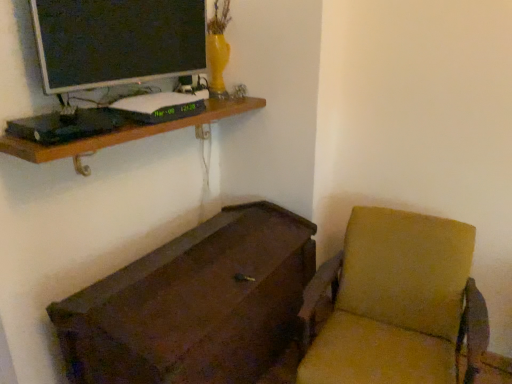
Question: From a real-world perspective, is brown wooden chest at lower left above or below brown wooden shelf at upper left?

Choices:
 (A) below
 (B) above

Answer: (A)

Question: Is brown wooden chest at lower left taller or shorter than brown wooden shelf at upper left?

Choices:
 (A) tall
 (B) short

Answer: (A)

Question: Which of these objects is positioned farthest from the matte black monitor at upper left?

Choices:
 (A) brown wooden chest at lower left
 (B) brown wooden shelf at upper left
 (C) textured beige swivel chair at lower right

Answer: (C)

Question: Which of these objects is positioned farthest from the matte black monitor at upper left?

Choices:
 (A) brown wooden shelf at upper left
 (B) textured beige swivel chair at lower right
 (C) brown wooden chest at lower left

Answer: (B)